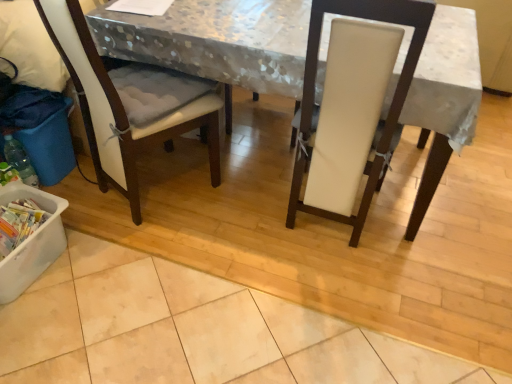
Question: Is white fabric-covered table at center at the left side of blue plastic recycling bin at lower left, acting as the first recycling bin starting from the top?

Choices:
 (A) yes
 (B) no

Answer: (B)

Question: Is white fabric-covered table at center closer to camera compared to blue plastic recycling bin at lower left, acting as the first recycling bin starting from the top?

Choices:
 (A) no
 (B) yes

Answer: (B)

Question: Is white fabric-covered table at center turned away from blue plastic recycling bin at lower left, which ranks as the second recycling bin in bottom-to-top order?

Choices:
 (A) yes
 (B) no

Answer: (A)

Question: From a real-world perspective, is white fabric-covered table at center physically above blue plastic recycling bin at lower left, acting as the first recycling bin starting from the top?

Choices:
 (A) yes
 (B) no

Answer: (A)

Question: Does white fabric-covered table at center touch blue plastic recycling bin at lower left, which ranks as the second recycling bin in bottom-to-top order?

Choices:
 (A) yes
 (B) no

Answer: (B)

Question: Looking at their shapes, would you say white leather chair at center, which is the 1th chair from right to left, is wider or thinner than white fabric-covered table at center?

Choices:
 (A) wide
 (B) thin

Answer: (B)

Question: Visually, is white leather chair at center, which is the 1th chair from right to left, positioned to the left or to the right of white fabric-covered table at center?

Choices:
 (A) right
 (B) left

Answer: (A)

Question: Considering the positions of white leather chair at center, the second chair when ordered from left to right, and white fabric-covered table at center in the image, is white leather chair at center, the second chair when ordered from left to right, bigger or smaller than white fabric-covered table at center?

Choices:
 (A) small
 (B) big

Answer: (A)

Question: From a real-world perspective, is white leather chair at center, the second chair when ordered from left to right, above or below white fabric-covered table at center?

Choices:
 (A) below
 (B) above

Answer: (B)

Question: Considering the positions of white fabric-covered table at center and white fabric chair at left, the 1th chair in the left-to-right sequence, in the image, is white fabric-covered table at center taller or shorter than white fabric chair at left, the 1th chair in the left-to-right sequence,?

Choices:
 (A) short
 (B) tall

Answer: (A)

Question: Choose the correct answer: Is white fabric-covered table at center inside white fabric chair at left, the second chair positioned from the right, or outside it?

Choices:
 (A) outside
 (B) inside

Answer: (A)

Question: Is point [x=416, y=96] closer or farther from the camera than point [x=92, y=72]?

Choices:
 (A) farther
 (B) closer

Answer: (A)

Question: Looking at their shapes, would you say white fabric-covered table at center is wider or thinner than white fabric chair at left, the 1th chair in the left-to-right sequence?

Choices:
 (A) thin
 (B) wide

Answer: (B)

Question: Based on their sizes in the image, would you say white plastic container at lower left, placed as the 2th recycling bin when sorted from top to bottom, is bigger or smaller than translucent plastic bottle at lower left?

Choices:
 (A) small
 (B) big

Answer: (B)

Question: Does point (10, 286) appear closer or farther from the camera than point (15, 163)?

Choices:
 (A) closer
 (B) farther

Answer: (A)